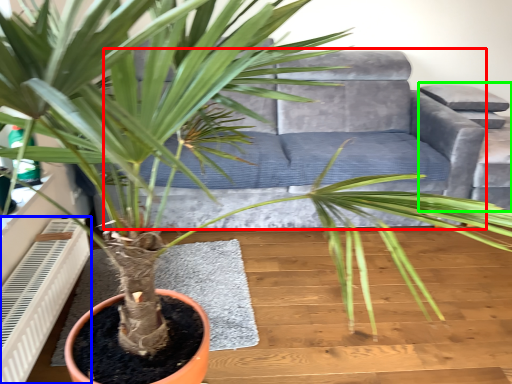
Question: Which object is the farthest from couch (highlighted by a red box)? Choose among these: air conditioner (highlighted by a blue box) or armchair (highlighted by a green box).

Choices:
 (A) air conditioner
 (B) armchair

Answer: (A)